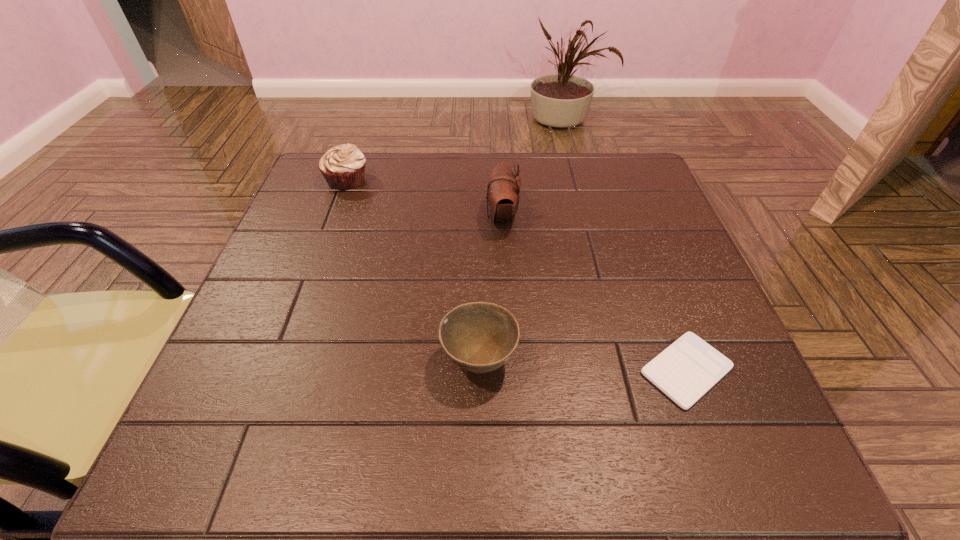
The image size is (960, 540). I want to click on pouch, so click(x=503, y=192).

Locate an element on the screen. The image size is (960, 540). the second farthest object is located at coordinates (503, 192).

Find the location of a particular element. The width and height of the screenshot is (960, 540). muffin is located at coordinates (343, 166).

Identify the location of the leftmost object. (343, 166).

I want to click on bowl, so click(x=479, y=337).

Where is `the shortest object`? The height and width of the screenshot is (540, 960). the shortest object is located at coordinates (687, 369).

Identify the location of the rightmost object. Image resolution: width=960 pixels, height=540 pixels. (687, 369).

Identify the location of vacant space located with the flap open on the third nearest object. Image resolution: width=960 pixels, height=540 pixels. (331, 217).

Locate an element on the screen. This screenshot has width=960, height=540. free spot located with the flap open on the third nearest object is located at coordinates (426, 217).

Where is `free space located with the flap open on the third nearest object`? free space located with the flap open on the third nearest object is located at coordinates (439, 217).